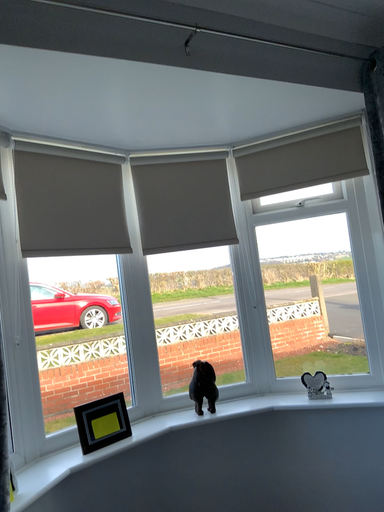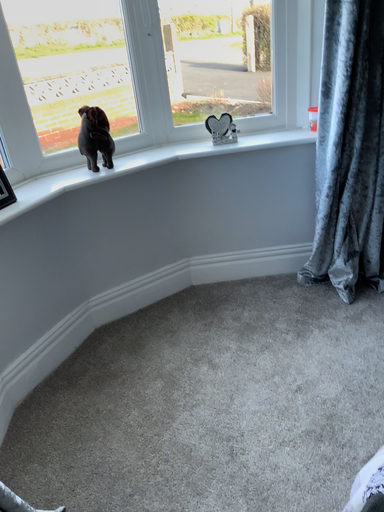
Question: Which way did the camera rotate in the video?

Choices:
 (A) rotated upward
 (B) rotated downward

Answer: (B)